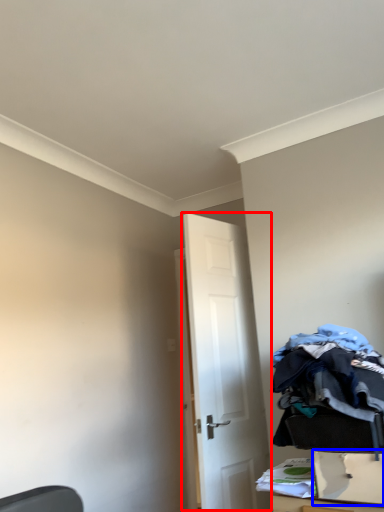
Question: Which point is closer to the camera, door (highlighted by a red box) or drawer (highlighted by a blue box)?

Choices:
 (A) door
 (B) drawer

Answer: (B)